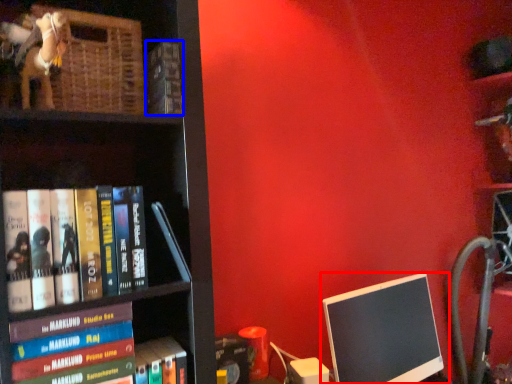
Question: Among these objects, which one is nearest to the camera, computer monitor (highlighted by a red box) or book (highlighted by a blue box)?

Choices:
 (A) computer monitor
 (B) book

Answer: (B)